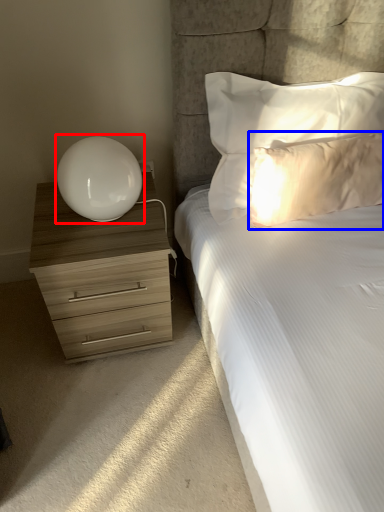
Question: Which of the following is the closest to the observer, table lamp (highlighted by a red box) or pillow (highlighted by a blue box)?

Choices:
 (A) table lamp
 (B) pillow

Answer: (A)